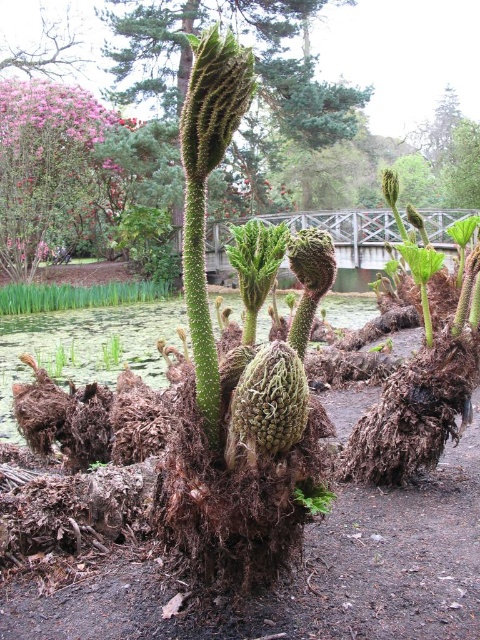
Question: Which of the following is the closest to the observer?

Choices:
 (A) green fuzzy plant at center
 (B) pink fluffy flower at upper left

Answer: (B)

Question: Does green fuzzy plant at center appear under pink fluffy flower at upper left?

Choices:
 (A) yes
 (B) no

Answer: (B)

Question: Is green fuzzy plant at center further to camera compared to pink fluffy flower at upper left?

Choices:
 (A) yes
 (B) no

Answer: (A)

Question: Which point is farther to the camera?

Choices:
 (A) pink fluffy flower at upper left
 (B) green fuzzy plant at center

Answer: (B)

Question: Is green fuzzy plant at center below pink fluffy flower at upper left?

Choices:
 (A) yes
 (B) no

Answer: (B)

Question: Which object appears closest to the camera in this image?

Choices:
 (A) pink fluffy flower at upper left
 (B) green fuzzy plant at center

Answer: (A)